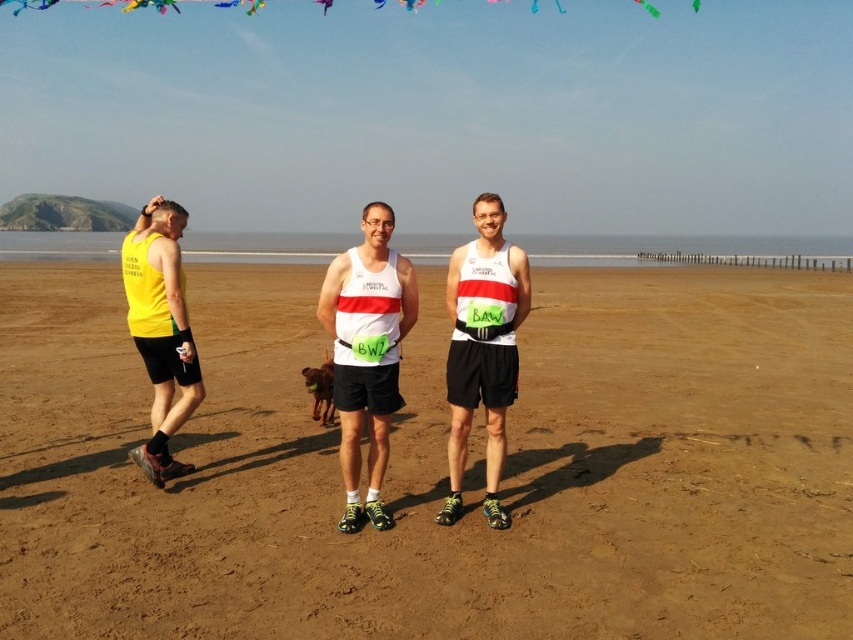
Which is in front, point (91, 637) or point (148, 365)?

Point (91, 637)

Does brown sandy beach at center lie behind yellow fabric tank top at left?

That is False.

Identify the location of brown sandy beach at center. The image size is (853, 640). (437, 467).

Identify the location of brown sandy beach at center. (437, 467).

Which is behind, point (410, 394) or point (515, 284)?

Point (410, 394)

Between point (425, 588) and point (497, 458), which one is positioned in front?

Point (425, 588)

Find the location of a particular element. Image resolution: width=853 pixels, height=640 pixels. brown sandy beach at center is located at coordinates (437, 467).

In the scene shown: Which is more to the right, white matte singlet at center or matte black singlet at center?

matte black singlet at center

Can you confirm if white matte singlet at center is thinner than matte black singlet at center?

Yes, white matte singlet at center is thinner than matte black singlet at center.

Does point (364, 218) lie in front of point (459, 406)?

Yes, point (364, 218) is closer to viewer.

The width and height of the screenshot is (853, 640). In order to click on white matte singlet at center in this screenshot , I will do `click(367, 353)`.